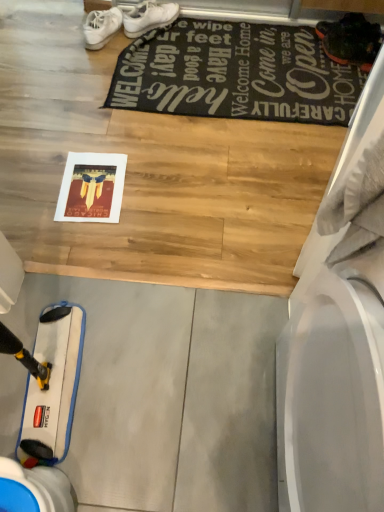
You are a GUI agent. You are given a task and a screenshot of the screen. Output one action in this format:
    pyautogui.click(x=<x>, y=<y>)
    Task: Click on the vacant area that is in front of black fabric mat at upper center
    
    Given the screenshot: What is the action you would take?
    pyautogui.click(x=164, y=176)